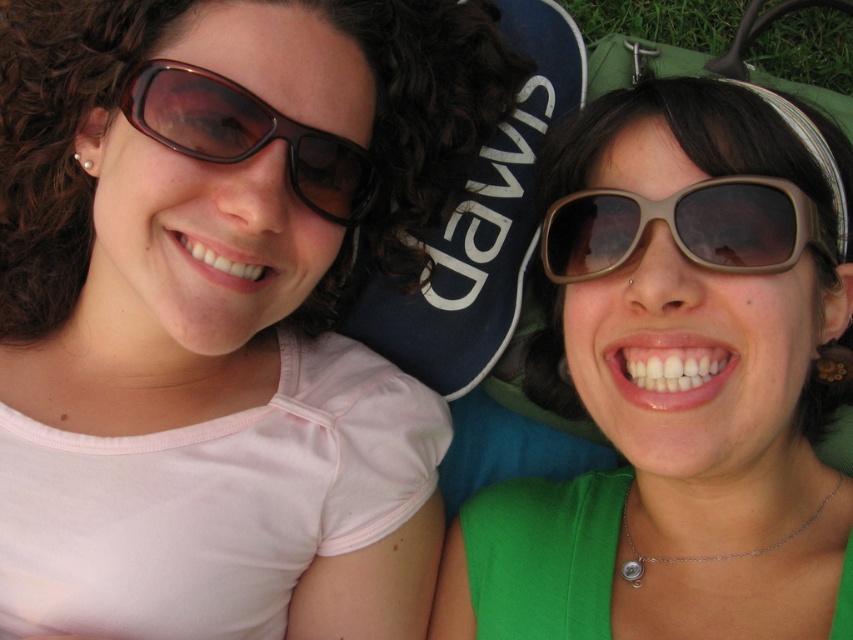
You are a photographer trying to capture a closeup of the matte brown sunglasses at upper left and the matte brown sunglasses at center. Since you want to focus on the smaller pair, which one should you zoom in on?

The matte brown sunglasses at center is smaller than the matte brown sunglasses at upper left, so you should zoom in on the matte brown sunglasses at center.

You are a photographer adjusting your camera to focus on the matte brown sunglasses at upper left and the matte brown sunglasses at center. Which pair should you focus on first if you want to start with the one closer to you?

The matte brown sunglasses at upper left is closer to you than the matte brown sunglasses at center, so you should focus on the matte brown sunglasses at upper left first.

You are a photographer trying to focus on the person wearing the matte brown sunglasses at center. You notice a point at coordinates (677, 385). Is this point located on the sunglasses?

Yes, the point at (677, 385) is located on the matte brown sunglasses at center as stated in the objects description.